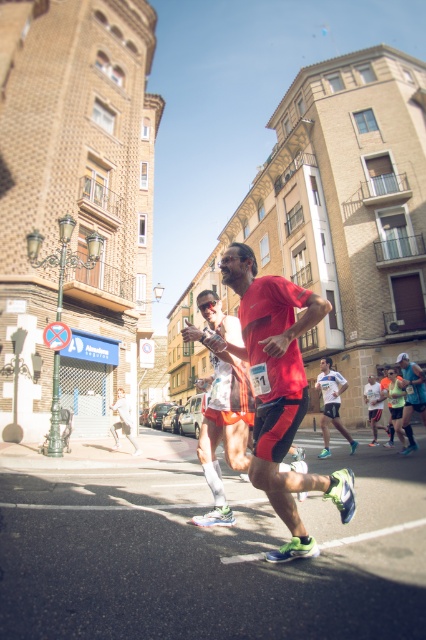
Question: Considering the real-world distances, which object is farthest from the white matte running shirt at center?

Choices:
 (A) matte red shirt at center
 (B) matte red shorts at center

Answer: (A)

Question: Is matte red shirt at center further to the viewer compared to white matte running shirt at center?

Choices:
 (A) yes
 (B) no

Answer: (B)

Question: Which object appears farthest from the camera in this image?

Choices:
 (A) matte red shorts at center
 (B) matte white tank top at center
 (C) white matte running shirt at center
 (D) matte red shirt at center

Answer: (C)

Question: Which of these objects is positioned closest to the matte red shorts at center?

Choices:
 (A) matte red shirt at center
 (B) white matte running shirt at center

Answer: (B)

Question: Does matte red shirt at center have a lesser width compared to matte red shorts at center?

Choices:
 (A) no
 (B) yes

Answer: (A)

Question: Is matte red shirt at center to the left of matte white tank top at center from the viewer's perspective?

Choices:
 (A) no
 (B) yes

Answer: (A)